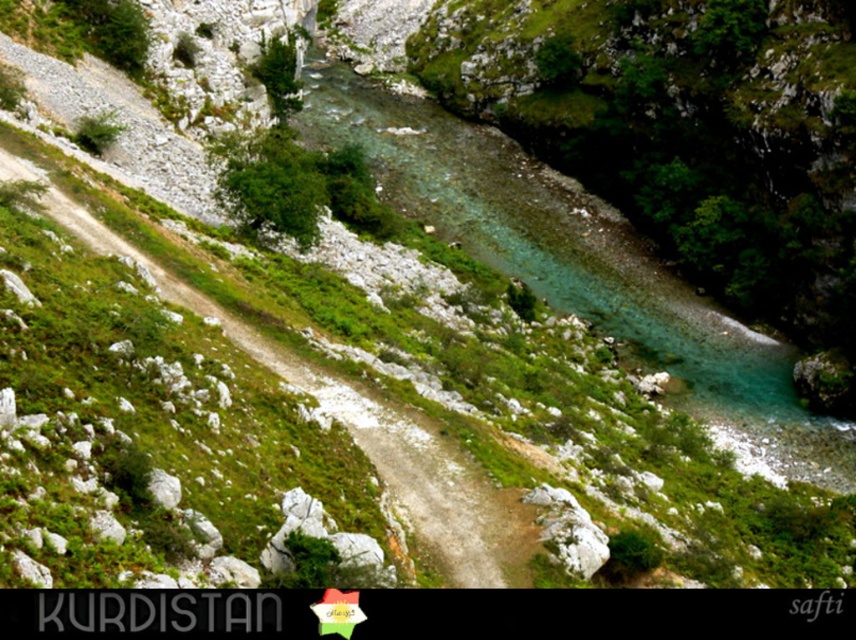
Can you confirm if clear water at center is taller than dirt path at center?

Correct, clear water at center is much taller as dirt path at center.

Is point (574, 280) less distant than point (425, 456)?

No.

The width and height of the screenshot is (856, 640). What are the coordinates of `clear water at center` in the screenshot? It's located at tap(578, 266).

Locate an element on the screen. clear water at center is located at coordinates (578, 266).